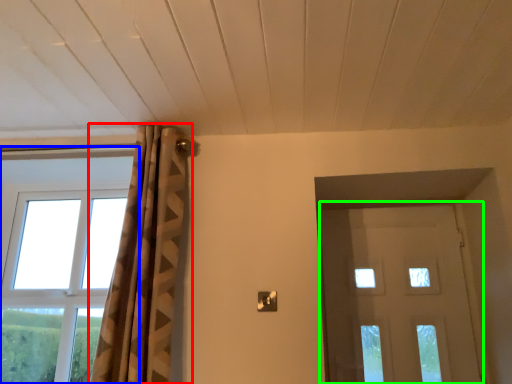
Question: Based on their relative distances, which object is nearer to curtain (highlighted by a red box)? Choose from window (highlighted by a blue box) and door (highlighted by a green box).

Choices:
 (A) window
 (B) door

Answer: (A)